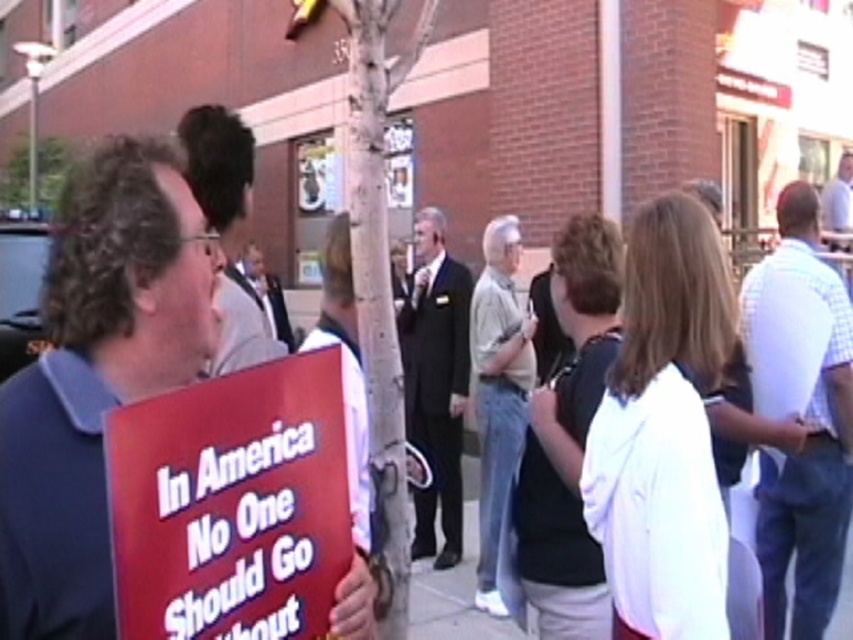
Question: Considering the real-world distances, which object is farthest from the white checkered shirt at right?

Choices:
 (A) light brown denim jeans at lower center
 (B) gray concrete pavement at lower center
 (C) red cardboard sign at center

Answer: (C)

Question: Observing the image, what is the correct spatial positioning of white checkered shirt at right in reference to dark suit at center?

Choices:
 (A) below
 (B) above

Answer: (B)

Question: Does blue fabric shirt at center appear under light brown denim jeans at lower center?

Choices:
 (A) no
 (B) yes

Answer: (A)

Question: Does dark suit at center appear over light brown denim jeans at lower center?

Choices:
 (A) no
 (B) yes

Answer: (B)

Question: Among these points, which one is nearest to the camera?

Choices:
 (A) (425, 534)
 (B) (490, 276)

Answer: (B)

Question: Among these objects, which one is nearest to the camera?

Choices:
 (A) white checkered shirt at right
 (B) blue fabric shirt at center

Answer: (B)